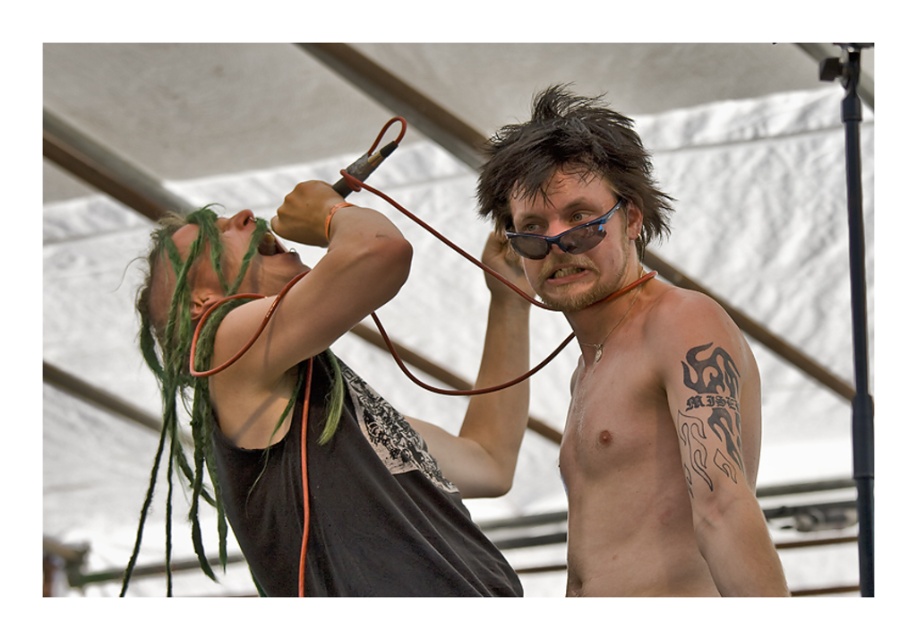
Question: Which point is closer to the camera?

Choices:
 (A) black matte shirt at center
 (B) blue plastic goggles at center

Answer: (A)

Question: Among these points, which one is nearest to the camera?

Choices:
 (A) (540, 248)
 (B) (388, 484)

Answer: (B)

Question: Where is black matte shirt at center located in relation to dark brown hair at upper center in the image?

Choices:
 (A) above
 (B) below

Answer: (B)

Question: Does black matte shirt at center have a larger size compared to dark brown hair at upper center?

Choices:
 (A) yes
 (B) no

Answer: (A)

Question: Where is dark brown hair at upper center located in relation to blue plastic goggles at center in the image?

Choices:
 (A) right
 (B) left

Answer: (A)

Question: Among these objects, which one is farthest from the camera?

Choices:
 (A) dark brown hair at upper center
 (B) shiny black sunglasses at center
 (C) blue plastic goggles at center

Answer: (C)